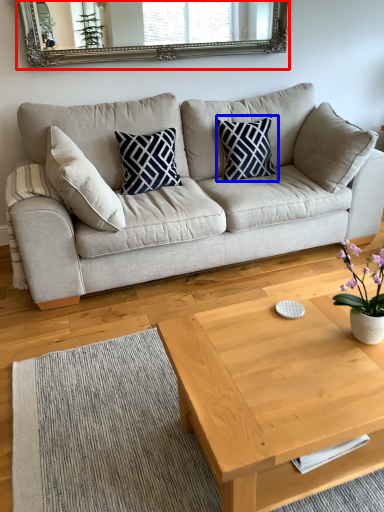
Question: Among these objects, which one is farthest to the camera, mirror (highlighted by a red box) or pillow (highlighted by a blue box)?

Choices:
 (A) mirror
 (B) pillow

Answer: (B)